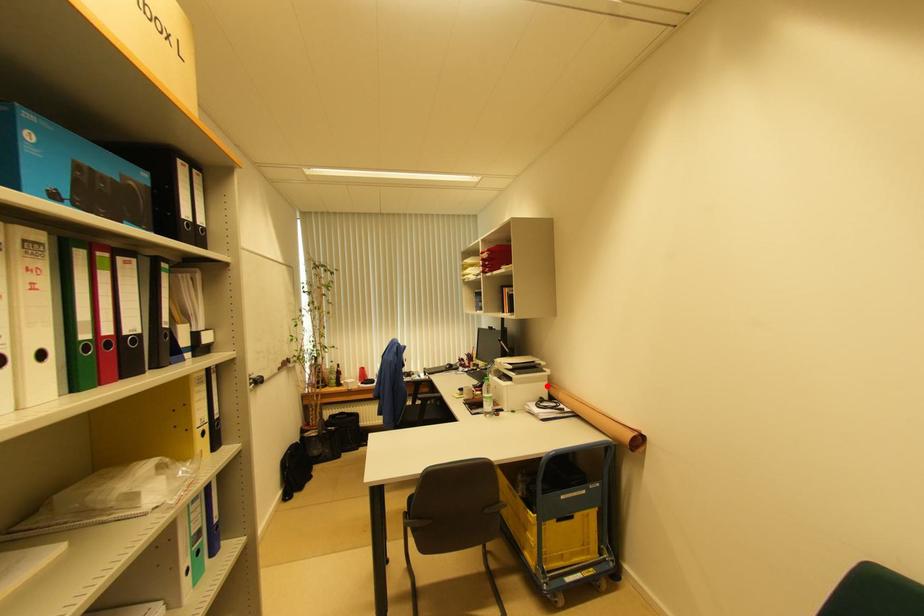
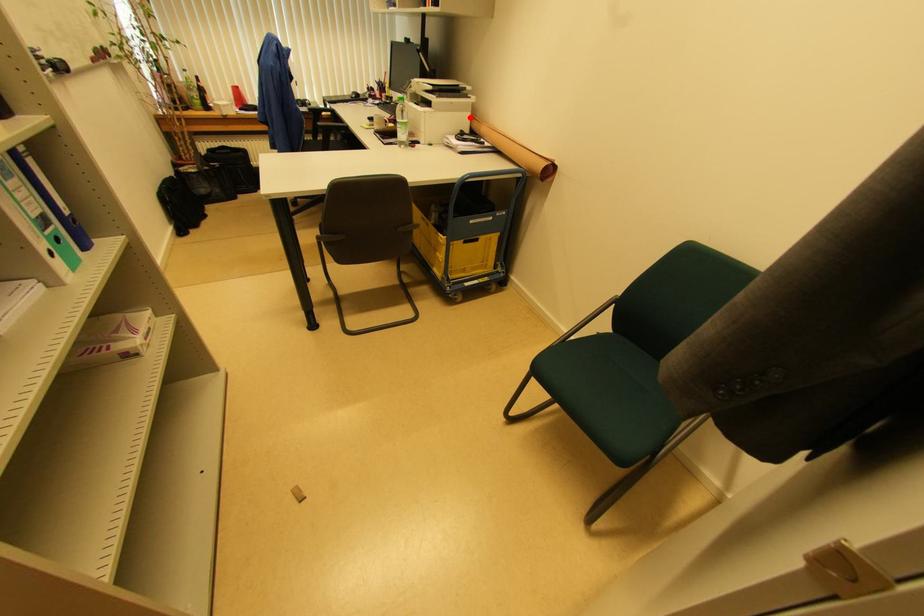
I am providing you with two images of the same scene from different viewpoints. A red point is marked on the first image and another point is marked on the second image. Are the points marked in image1 and image2 representing the same 3D position?

Yes